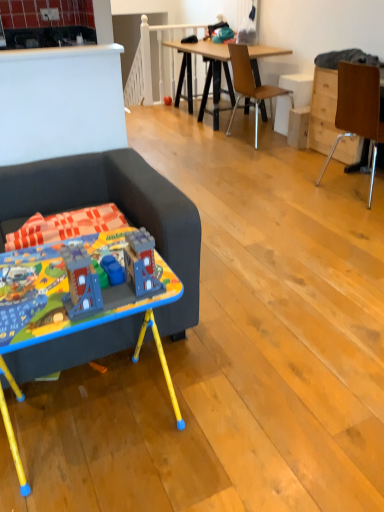
Image resolution: width=384 pixels, height=512 pixels. Identify the location of free region on the left part of plastic toy castle at left, which is the 2th toy in top-to-bottom order. (35, 294).